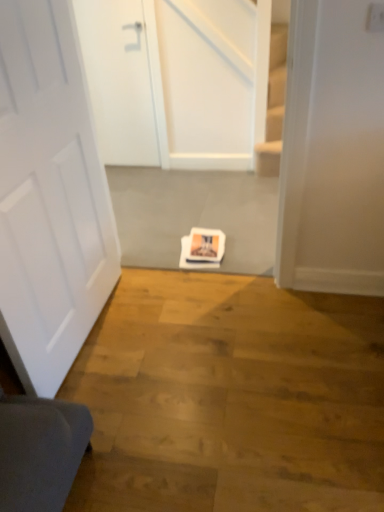
Question: Is white matte door at center, the second door when ordered from back to front, a part of white matte door at upper left, which ranks as the first door in top-to-bottom order?

Choices:
 (A) yes
 (B) no

Answer: (B)

Question: Considering the relative positions of white matte door at upper left, which ranks as the first door in top-to-bottom order, and white matte door at center, the 1th door viewed from the front, in the image provided, is white matte door at upper left, which ranks as the first door in top-to-bottom order, to the right of white matte door at center, the 1th door viewed from the front, from the viewer's perspective?

Choices:
 (A) yes
 (B) no

Answer: (B)

Question: Can you confirm if white matte door at upper left, the 2th door viewed from the front, is wider than white matte door at center, arranged as the first door when ordered from the bottom?

Choices:
 (A) no
 (B) yes

Answer: (B)

Question: From a real-world perspective, is white matte door at upper left, arranged as the 1th door when viewed from the back, below white matte door at center, the 2th door from the top?

Choices:
 (A) yes
 (B) no

Answer: (A)

Question: From a real-world perspective, is white matte door at upper left, arranged as the 2th door when ordered from the bottom, positioned over white matte door at center, arranged as the first door when ordered from the bottom, based on gravity?

Choices:
 (A) no
 (B) yes

Answer: (A)

Question: Does white matte door at upper left, arranged as the 2th door when ordered from the bottom, have a smaller size compared to white matte door at center, the second door when ordered from back to front?

Choices:
 (A) no
 (B) yes

Answer: (B)

Question: Considering the relative positions of white matte door at center, the 2th door from the top, and white matte door at upper left, arranged as the 2th door when ordered from the bottom, in the image provided, is white matte door at center, the 2th door from the top, behind white matte door at upper left, arranged as the 2th door when ordered from the bottom,?

Choices:
 (A) yes
 (B) no

Answer: (B)

Question: Would you say white matte door at center, arranged as the first door when ordered from the bottom, is outside white matte door at upper left, which ranks as the first door in top-to-bottom order?

Choices:
 (A) no
 (B) yes

Answer: (B)

Question: Is white matte door at center, the 1th door viewed from the front, to the right of white matte door at upper left, arranged as the 1th door when viewed from the back, from the viewer's perspective?

Choices:
 (A) no
 (B) yes

Answer: (B)

Question: Is white matte door at center, the second door when ordered from back to front, thinner than white matte door at upper left, arranged as the 2th door when ordered from the bottom?

Choices:
 (A) yes
 (B) no

Answer: (A)

Question: Is white matte door at center, the 2th door from the top, aimed at white matte door at upper left, arranged as the 2th door when ordered from the bottom?

Choices:
 (A) yes
 (B) no

Answer: (B)

Question: From the image's perspective, is white matte door at center, the 1th door viewed from the front, on top of white matte door at upper left, arranged as the 1th door when viewed from the back?

Choices:
 (A) no
 (B) yes

Answer: (A)

Question: Is white matte door at upper left, arranged as the 1th door when viewed from the back, spatially inside white matte door at center, the 1th door viewed from the front, or outside of it?

Choices:
 (A) inside
 (B) outside

Answer: (B)